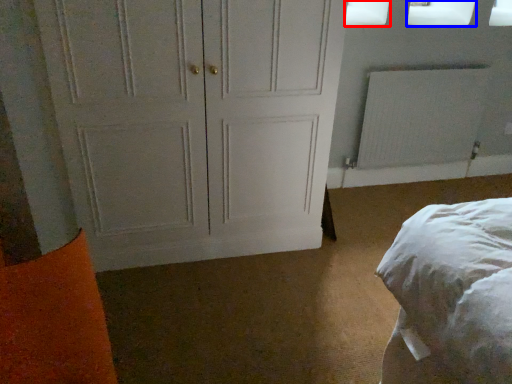
Question: Among these objects, which one is nearest to the camera, window screen (highlighted by a red box) or window screen (highlighted by a blue box)?

Choices:
 (A) window screen
 (B) window screen

Answer: (A)